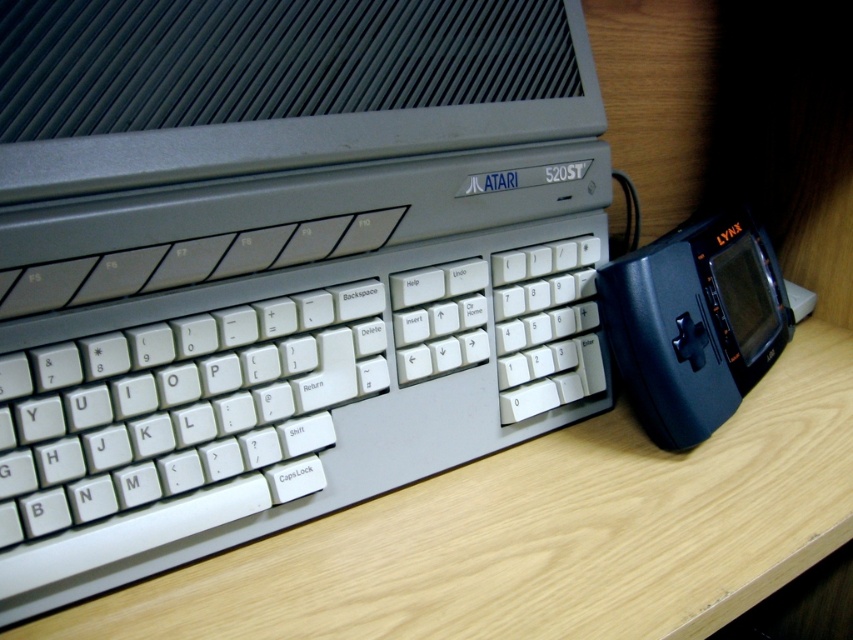
Describe the element at coordinates (276, 262) in the screenshot. I see `matte gray computer at center` at that location.

Is point (561, 134) farther from camera compared to point (288, 598)?

Yes, point (561, 134) is farther from viewer.

Describe the element at coordinates (276, 262) in the screenshot. This screenshot has height=640, width=853. I see `matte gray computer at center` at that location.

Locate an element on the screen. matte gray computer at center is located at coordinates (276, 262).